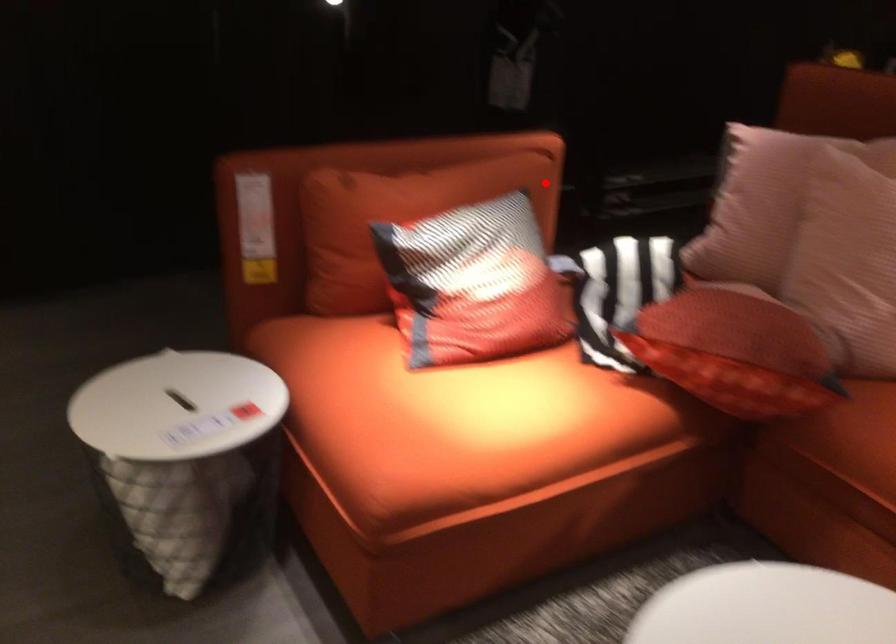
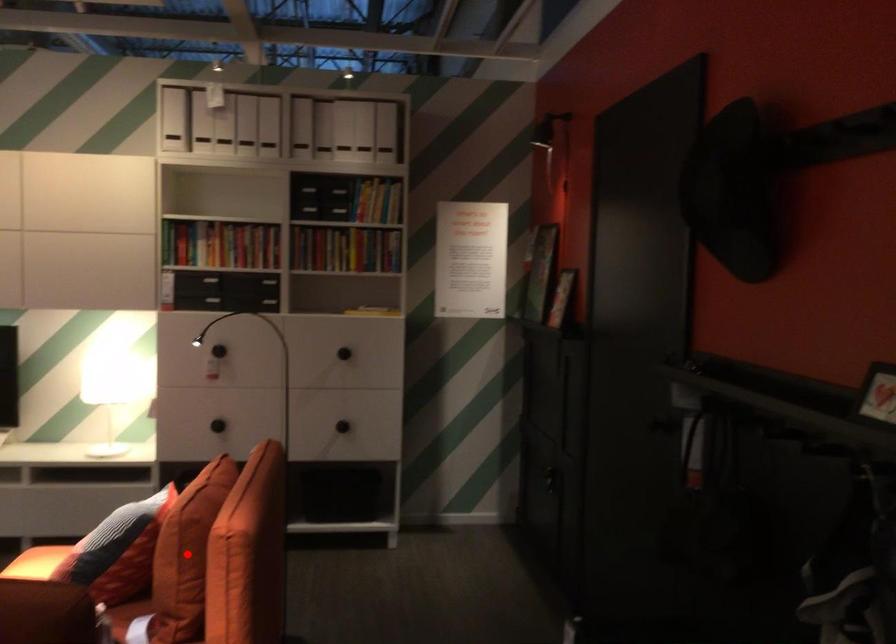
I am providing you with two images of the same scene from different viewpoints. A red point is marked on the first image and another point is marked on the second image. Do the highlighted points in image1 and image2 indicate the same real-world spot?

Yes